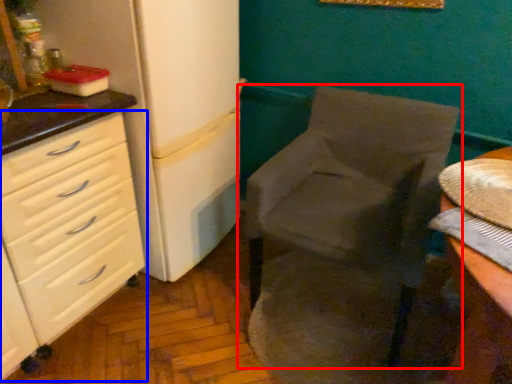
Question: Which object is closer to the camera taking this photo, chair (highlighted by a red box) or chest of drawers (highlighted by a blue box)?

Choices:
 (A) chair
 (B) chest of drawers

Answer: (B)